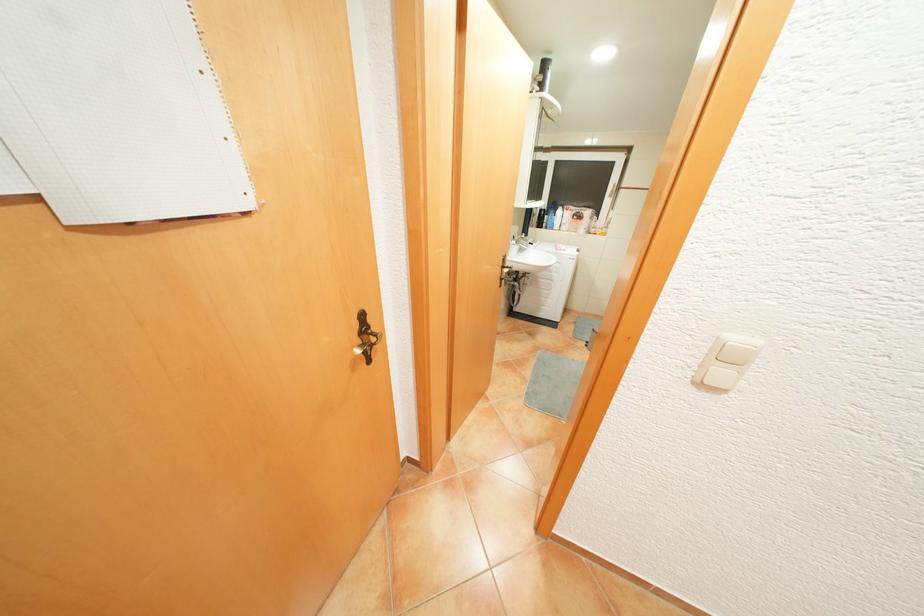
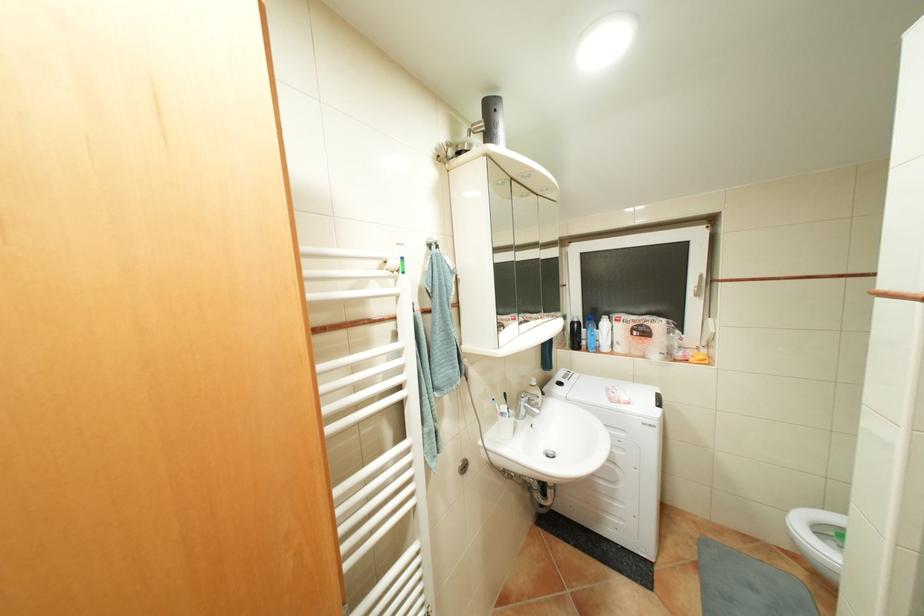
Find the pixel in the second image that matches [619,196] in the first image.

(707, 294)